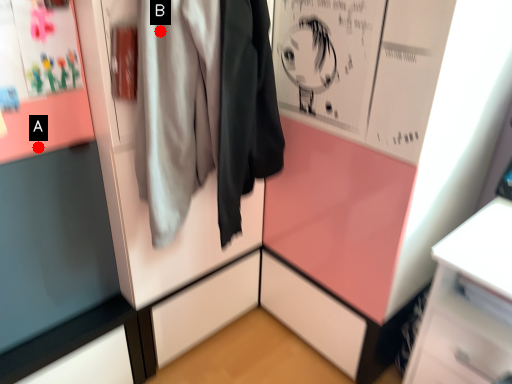
Question: Two points are circled on the image, labeled by A and B beside each circle. Which point appears closest to the camera in this image?

Choices:
 (A) A is closer
 (B) B is closer

Answer: (B)